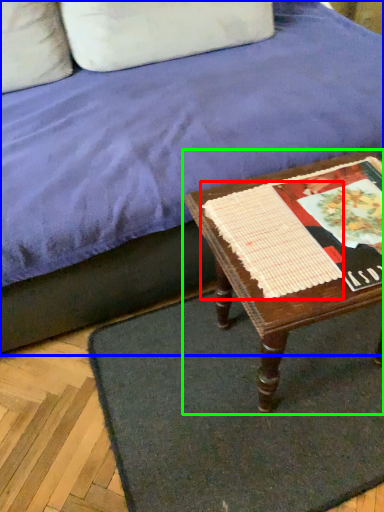
Question: Based on their relative distances, which object is farther from linen (highlighted by a red box)? Choose from studio couch (highlighted by a blue box) and table (highlighted by a green box).

Choices:
 (A) studio couch
 (B) table

Answer: (A)